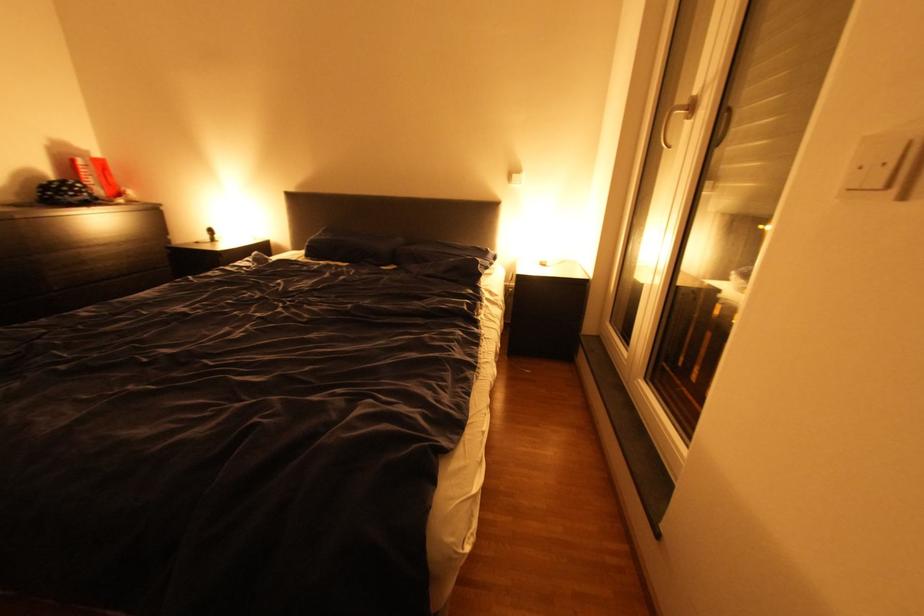
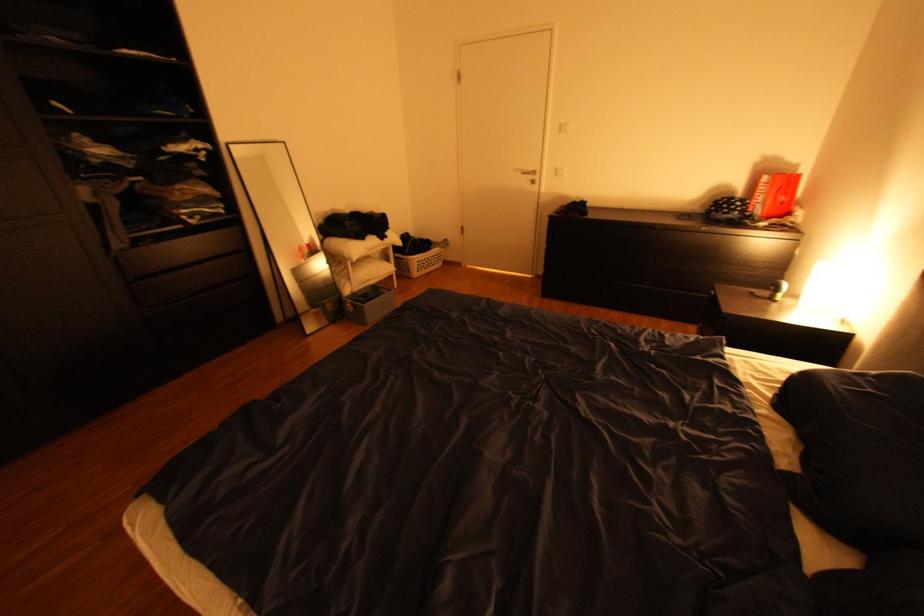
In the second image, find the point that corresponds to (92,190) in the first image.

(748, 208)